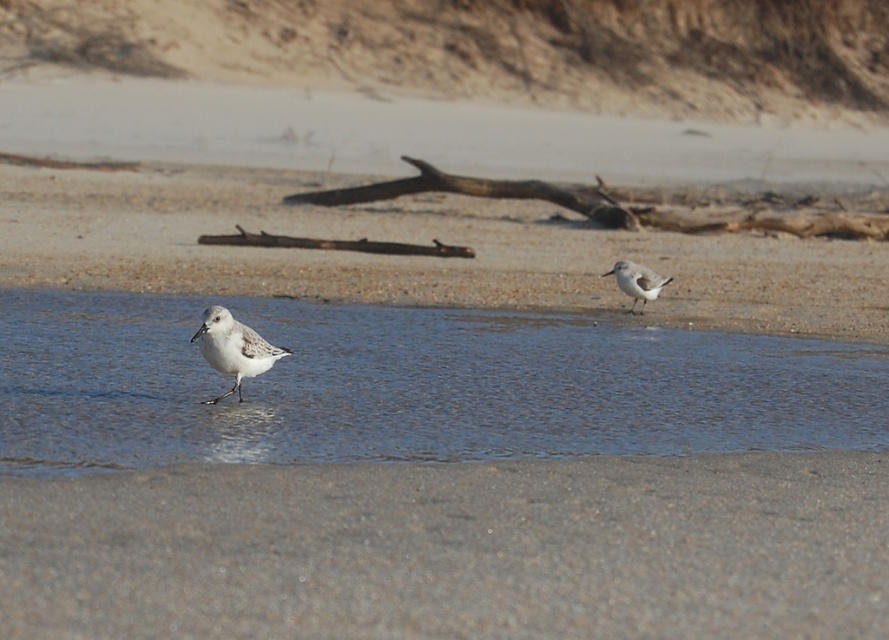
Question: Does white sand at center appear on the left side of white matte bird at center?

Choices:
 (A) yes
 (B) no

Answer: (A)

Question: Among these points, which one is nearest to the camera?

Choices:
 (A) (257, 342)
 (B) (45, 275)

Answer: (A)

Question: Considering the relative positions of brown rough log at center and white matte bird at center in the image provided, where is brown rough log at center located with respect to white matte bird at center?

Choices:
 (A) below
 (B) above

Answer: (B)

Question: Which object is closer to the camera taking this photo?

Choices:
 (A) white matte bird at center
 (B) brown rough log at center
 (C) white matte bird at upper right
 (D) white sand at center

Answer: (A)

Question: Among these points, which one is nearest to the camera?

Choices:
 (A) (11, 221)
 (B) (199, 324)
 (C) (421, 442)
 (D) (653, 198)

Answer: (C)

Question: Can you confirm if white sand at center is positioned to the left of white matte bird at upper right?

Choices:
 (A) no
 (B) yes

Answer: (B)